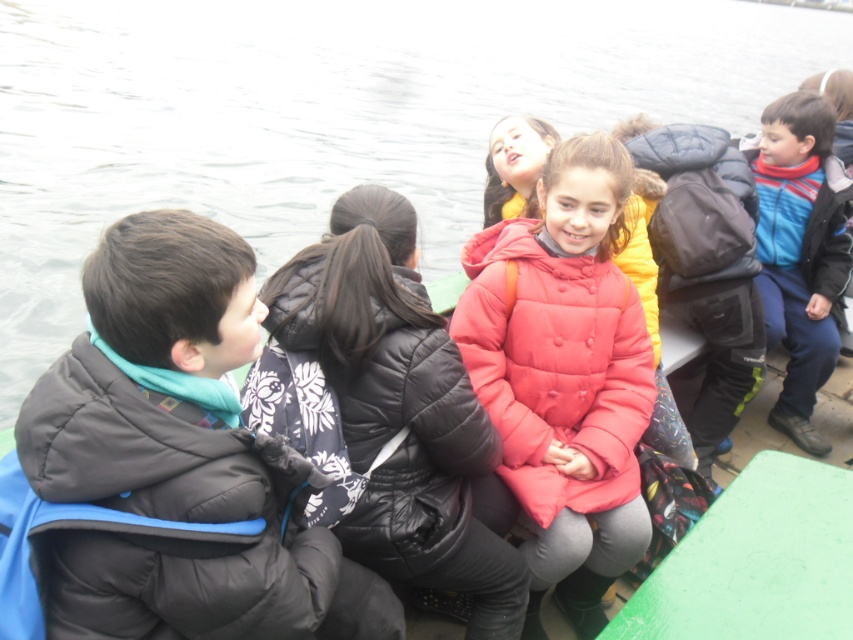
You are a photographer trying to capture the scene of the children on the boat. You want to ensure that both the transparent water at upper center and the black quilted jacket at center are clearly visible in your shot. Given their sizes, which object should you focus on first to ensure it takes up more space in the frame?

The transparent water at upper center is larger in size than the black quilted jacket at center, so you should focus on the transparent water at upper center first to ensure it takes up more space in the frame.

You are a photographer trying to capture a photo of the puffy red jacket at center and the transparent water at upper center. Based on their positions, which object is located to the right side of the other?

The transparent water at upper center is to the right of the puffy red jacket at center, so the transparent water at upper center is located to the right of the puffy red jacket at center.

You are standing on the boat and want to pour a drink into the transparent water at upper center. Where exactly should you aim to hit the water?

The transparent water at upper center is located at point (328,116), so aim for that coordinate.